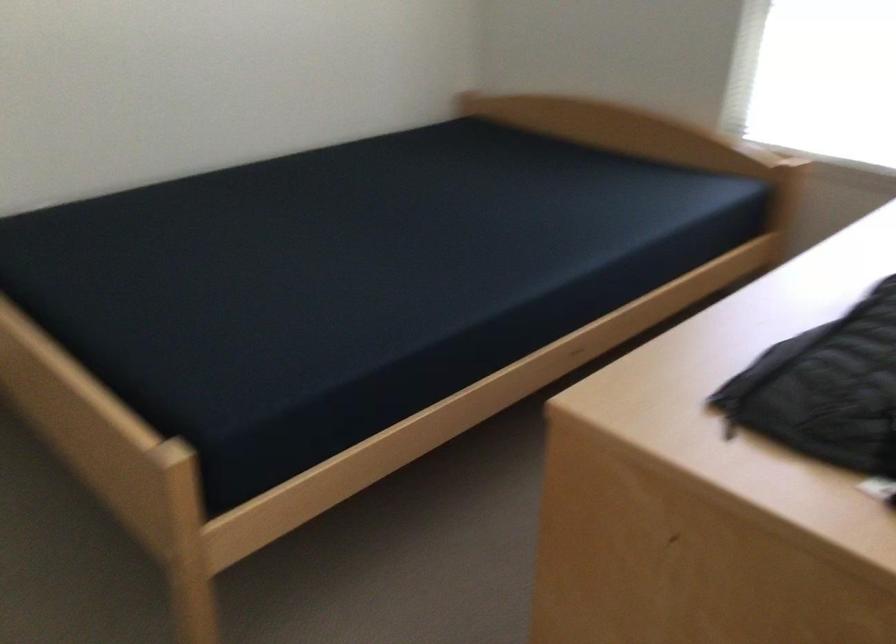
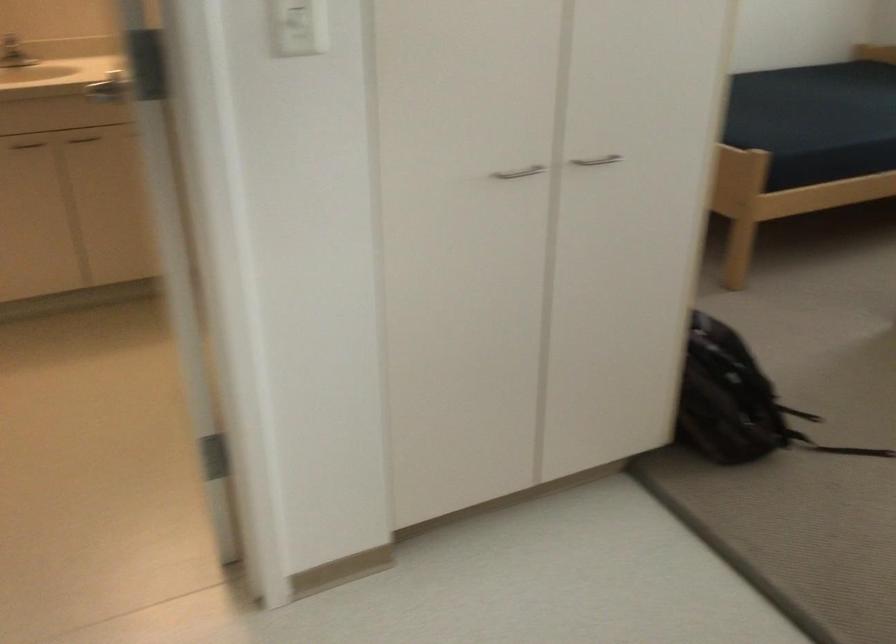
What movement of the cameraman would produce the second image?

The cameraman walked toward left, backward.